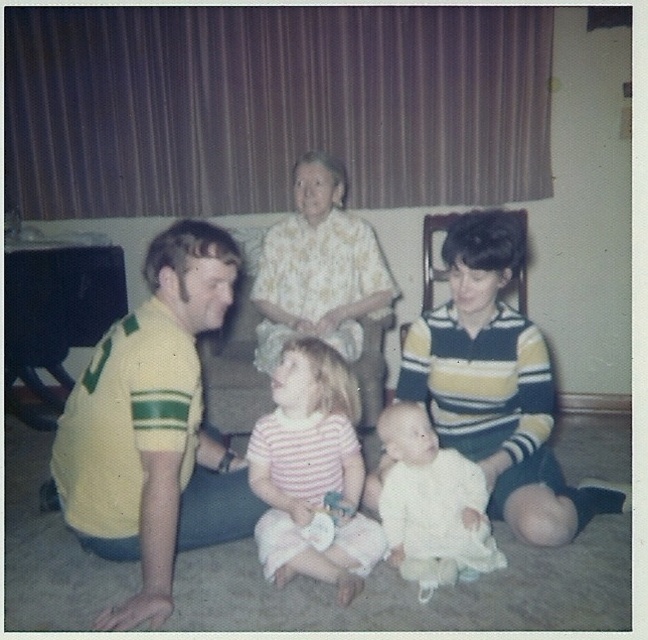
Question: Which of these objects is positioned closest to the white soft baby at center?

Choices:
 (A) yellow jersey at left
 (B) floral fabric blouse at center
 (C) yellow striped polo shirt at left
 (D) pink striped shirt at center

Answer: (C)

Question: Does pink striped shirt at center appear on the right side of white soft baby at center?

Choices:
 (A) yes
 (B) no

Answer: (B)

Question: Is floral fabric blouse at center below white soft baby at center?

Choices:
 (A) yes
 (B) no

Answer: (B)

Question: Which point is farther from the camera taking this photo?

Choices:
 (A) (176, 276)
 (B) (290, 326)

Answer: (B)

Question: Does yellow jersey at left have a larger size compared to floral fabric blouse at center?

Choices:
 (A) yes
 (B) no

Answer: (A)

Question: Which object is positioned closest to the yellow striped polo shirt at left?

Choices:
 (A) yellow jersey at left
 (B) white soft baby at center
 (C) pink striped shirt at center

Answer: (B)